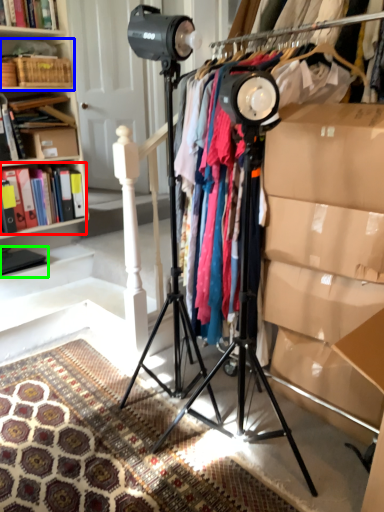
Question: Which object is positioned closest to book (highlighted by a red box)? Select from shelf (highlighted by a blue box) and book (highlighted by a green box).

Choices:
 (A) shelf
 (B) book

Answer: (B)